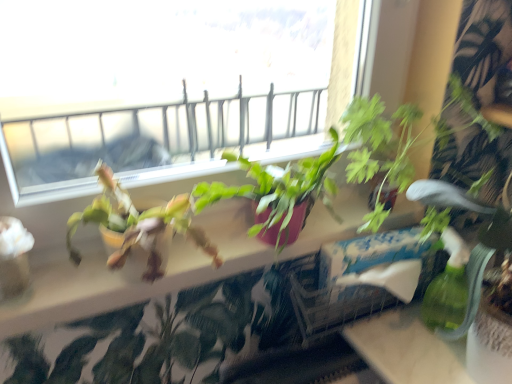
You are a GUI agent. You are given a task and a screenshot of the screen. Output one action in this format:
    pyautogui.click(x=<x>, y=<y>)
    Task: Click on the empty space that is ontop of matte pink pot at center (from a real-world perspective)
    The height and width of the screenshot is (384, 512).
    Given the screenshot: What is the action you would take?
    coord(234,244)